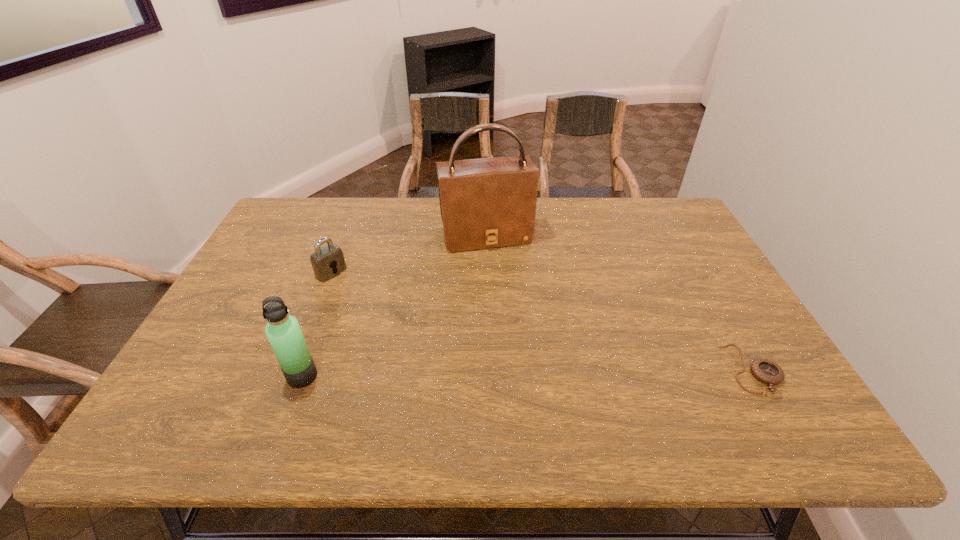
You are a GUI agent. You are given a task and a screenshot of the screen. Output one action in this format:
    pyautogui.click(x=<x>, y=<y>)
    Task: Click on the second tallest object
    The image size is (960, 540).
    Given the screenshot: What is the action you would take?
    pyautogui.click(x=283, y=331)

Where is `the rightmost object`? the rightmost object is located at coordinates (766, 371).

Find the location of a particular element. The height and width of the screenshot is (540, 960). the shortest object is located at coordinates (766, 371).

I want to click on padlock, so click(x=327, y=262).

This screenshot has height=540, width=960. Identify the location of the second shortest object. (327, 262).

At what (x,y) coordinates should I click in order to perform the action: click on the second object from right to left. Please return your answer as a coordinate pair (x, y). Image resolution: width=960 pixels, height=540 pixels. Looking at the image, I should click on (485, 203).

You are a GUI agent. You are given a task and a screenshot of the screen. Output one action in this format:
    pyautogui.click(x=<x>, y=<y>)
    Task: Click on the tallest object
    The image size is (960, 540).
    Given the screenshot: What is the action you would take?
    point(485,203)

Locate an element on the screen. free space located 0.140m on the back of the third shortest object is located at coordinates (323, 320).

The width and height of the screenshot is (960, 540). Identify the location of free location located 0.220m on the left of the rightmost object. (634, 370).

Locate an element on the screen. Image resolution: width=960 pixels, height=540 pixels. free space located at the front of the second shortest object near the keyhole is located at coordinates (370, 299).